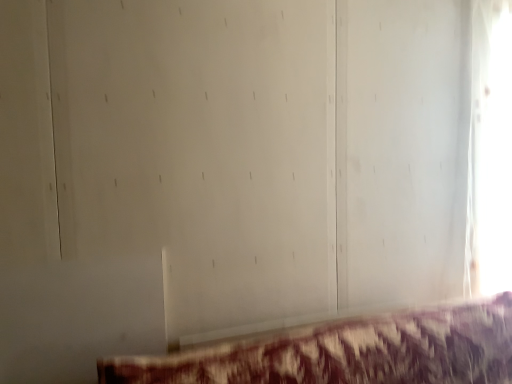
This screenshot has height=384, width=512. I want to click on maroon fabric couch at lower center, so click(348, 352).

What do you see at coordinates (348, 352) in the screenshot?
I see `maroon fabric couch at lower center` at bounding box center [348, 352].

This screenshot has height=384, width=512. What do you see at coordinates (490, 148) in the screenshot?
I see `transparent glass window at right` at bounding box center [490, 148].

Where is `transparent glass window at right`? Image resolution: width=512 pixels, height=384 pixels. transparent glass window at right is located at coordinates (490, 148).

The height and width of the screenshot is (384, 512). What are the coordinates of `maroon fabric couch at lower center` in the screenshot? It's located at (348, 352).

Visually, is maroon fabric couch at lower center positioned to the left or to the right of transparent glass window at right?

From the image, it's evident that maroon fabric couch at lower center is to the left of transparent glass window at right.

In the image, is maroon fabric couch at lower center positioned in front of or behind transparent glass window at right?

maroon fabric couch at lower center is in front of transparent glass window at right.

Is point (404, 335) closer to viewer compared to point (497, 72)?

Yes, point (404, 335) is in front of point (497, 72).

From the image's perspective, is maroon fabric couch at lower center below transparent glass window at right?

Indeed, from the image's perspective, maroon fabric couch at lower center is shown beneath transparent glass window at right.

From a real-world perspective, between maroon fabric couch at lower center and transparent glass window at right, who is vertically lower?

maroon fabric couch at lower center.

Can you confirm if maroon fabric couch at lower center is thinner than transparent glass window at right?

Incorrect, the width of maroon fabric couch at lower center is not less than that of transparent glass window at right.

Is maroon fabric couch at lower center shorter than transparent glass window at right?

Yes, maroon fabric couch at lower center is shorter than transparent glass window at right.

Does maroon fabric couch at lower center have a smaller size compared to transparent glass window at right?

No, maroon fabric couch at lower center is not smaller than transparent glass window at right.

Would you say maroon fabric couch at lower center is outside transparent glass window at right?

Indeed, maroon fabric couch at lower center is completely outside transparent glass window at right.

Consider the image. Would you say maroon fabric couch at lower center is a long distance from transparent glass window at right?

Actually, maroon fabric couch at lower center and transparent glass window at right are a little close together.

Is maroon fabric couch at lower center oriented away from transparent glass window at right?

maroon fabric couch at lower center does not have its back to transparent glass window at right.

How different are the orientations of maroon fabric couch at lower center and transparent glass window at right in degrees?

maroon fabric couch at lower center and transparent glass window at right are facing 0.787 degrees away from each other.

Where is `furniture on the left of transparent glass window at right`? The width and height of the screenshot is (512, 384). furniture on the left of transparent glass window at right is located at coordinates (348, 352).

Between transparent glass window at right and maroon fabric couch at lower center, which one appears on the right side from the viewer's perspective?

transparent glass window at right.

Looking at this image, which is in front, transparent glass window at right or maroon fabric couch at lower center?

maroon fabric couch at lower center is in front.

Which is in front, point (499, 14) or point (391, 364)?

The point (391, 364) is more forward.

From the image's perspective, is transparent glass window at right positioned above or below maroon fabric couch at lower center?

From the image's perspective, transparent glass window at right appears above maroon fabric couch at lower center.

From a real-world perspective, relative to maroon fabric couch at lower center, is transparent glass window at right vertically above or below?

transparent glass window at right is situated higher than maroon fabric couch at lower center in the real world.

Is transparent glass window at right thinner than maroon fabric couch at lower center?

Correct, the width of transparent glass window at right is less than that of maroon fabric couch at lower center.

Which of these two, transparent glass window at right or maroon fabric couch at lower center, stands taller?

Standing taller between the two is transparent glass window at right.

Does transparent glass window at right have a larger size compared to maroon fabric couch at lower center?

Incorrect, transparent glass window at right is not larger than maroon fabric couch at lower center.

Is transparent glass window at right located outside maroon fabric couch at lower center?

Indeed, transparent glass window at right is completely outside maroon fabric couch at lower center.

Is transparent glass window at right with maroon fabric couch at lower center?

There is a gap between transparent glass window at right and maroon fabric couch at lower center.

Is transparent glass window at right oriented towards maroon fabric couch at lower center?

No, transparent glass window at right is not turned towards maroon fabric couch at lower center.

Where is `window lying above the maroon fabric couch at lower center (from the image's perspective)`? window lying above the maroon fabric couch at lower center (from the image's perspective) is located at coordinates (490, 148).

The image size is (512, 384). I want to click on furniture below the transparent glass window at right (from a real-world perspective), so tap(348, 352).

I want to click on furniture on the left of the transparent glass window at right, so click(348, 352).